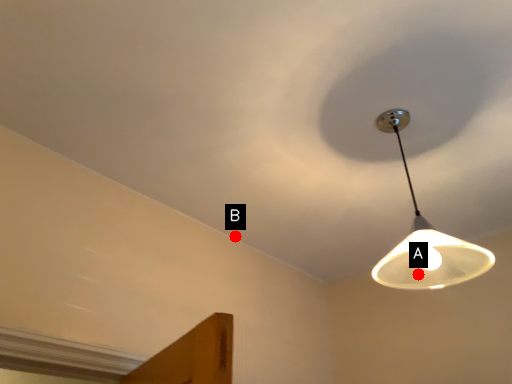
Question: Two points are circled on the image, labeled by A and B beside each circle. Which point appears closest to the camera in this image?

Choices:
 (A) A is closer
 (B) B is closer

Answer: (A)